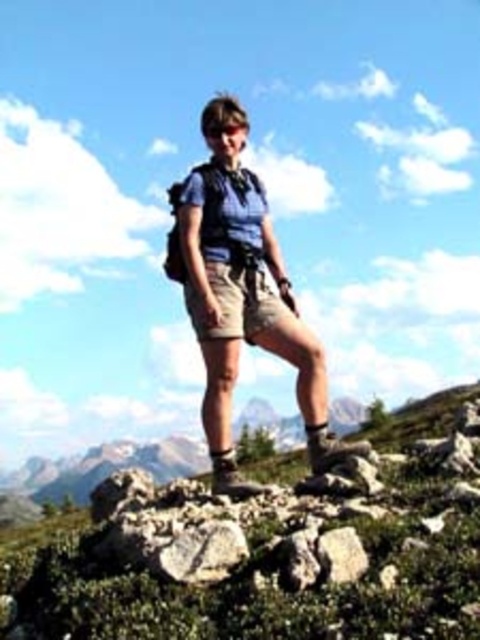
Can you confirm if leather at right is positioned above brown suede hiking boot at lower center?

No.

Is leather at right below brown suede hiking boot at lower center?

Correct, leather at right is located below brown suede hiking boot at lower center.

Is point (346, 448) behind point (214, 465)?

Yes, point (346, 448) is behind point (214, 465).

Find the location of `leather at right`. leather at right is located at coordinates (331, 449).

Is point (228, 308) closer to camera compared to point (225, 451)?

No, it is behind (225, 451).

Can you confirm if khaki cotton shorts at center is thinner than brown suede hiking boot at lower center?

Yes, khaki cotton shorts at center is thinner than brown suede hiking boot at lower center.

In order to click on khaki cotton shorts at center in this screenshot , I will do `click(236, 301)`.

Between khaki cotton shorts at center and leather at right, which one is positioned lower?

Positioned lower is leather at right.

Looking at this image, which of these two, khaki cotton shorts at center or leather at right, stands taller?

Standing taller between the two is leather at right.

Between point (282, 304) and point (311, 429), which one is positioned in front?

Point (311, 429) is in front.

Where is `khaki cotton shorts at center`? The image size is (480, 640). khaki cotton shorts at center is located at coordinates (236, 301).